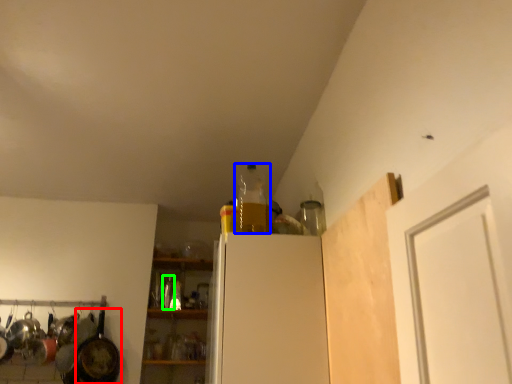
Question: Considering the real-world distances, which object is closest to frying pan (highlighted by a red box)? bottle (highlighted by a blue box) or bottle (highlighted by a green box).

Choices:
 (A) bottle
 (B) bottle

Answer: (B)